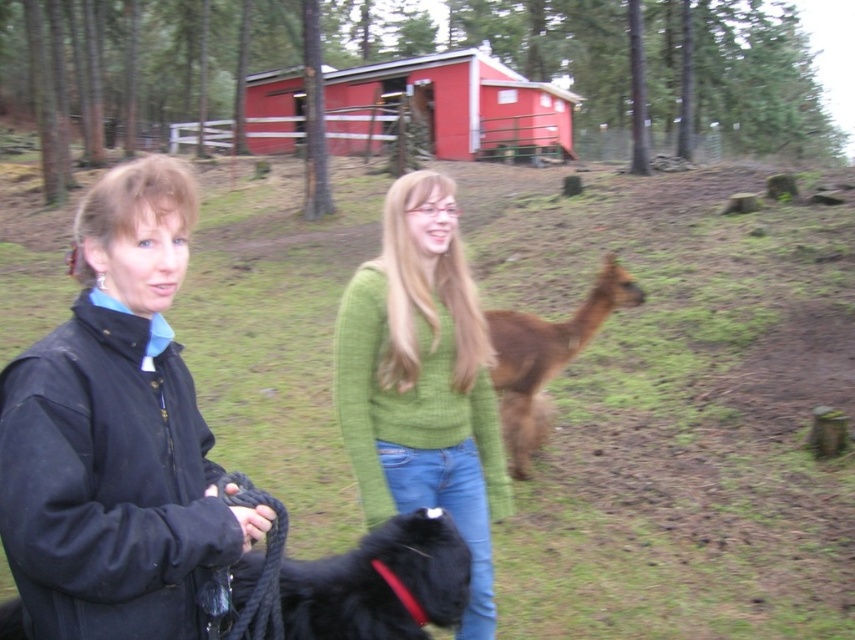
Which is more to the right, black fleece jacket at left or black fuzzy dog at lower center?

black fuzzy dog at lower center

Measure the distance between black fleece jacket at left and camera.

black fleece jacket at left is 4.05 feet from camera.

Where is `black fleece jacket at left`? This screenshot has height=640, width=855. black fleece jacket at left is located at coordinates (116, 435).

Who is more forward, (x=487, y=420) or (x=505, y=115)?

Positioned in front is point (x=487, y=420).

What do you see at coordinates (423, 381) in the screenshot? Image resolution: width=855 pixels, height=640 pixels. I see `green knitted sweater at center` at bounding box center [423, 381].

This screenshot has width=855, height=640. I want to click on green knitted sweater at center, so click(x=423, y=381).

Between point (296, 604) and point (537, 408), which one is positioned in front?

Positioned in front is point (296, 604).

Who is more forward, (374,602) or (502,355)?

Point (374,602) is more forward.

The width and height of the screenshot is (855, 640). What are the coordinates of `black fuzzy dog at lower center` in the screenshot? It's located at (380, 582).